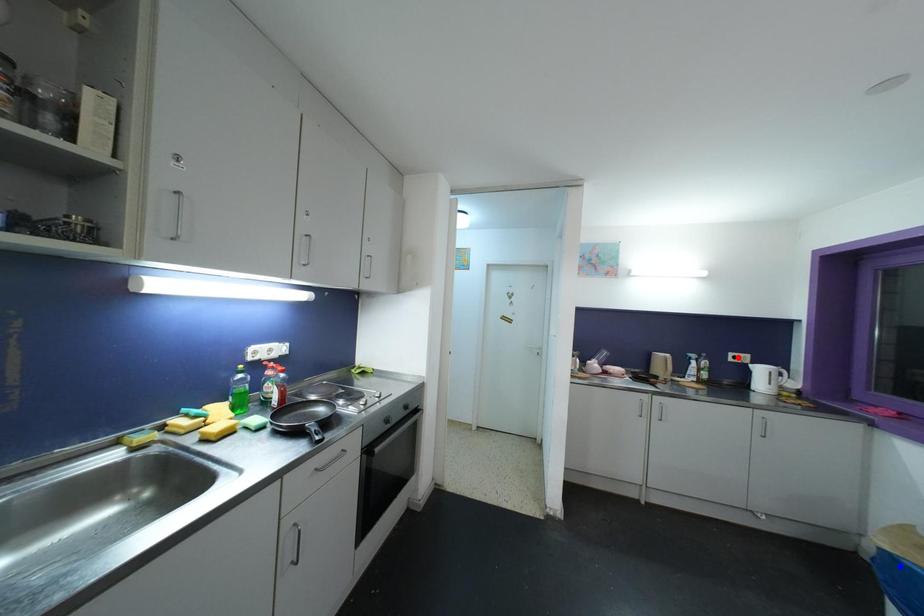
Question: In the image, two points are highlighted. Which point is nearer to the camera? Reply with the corresponding letter.

Choices:
 (A) blue point
 (B) red point

Answer: (A)